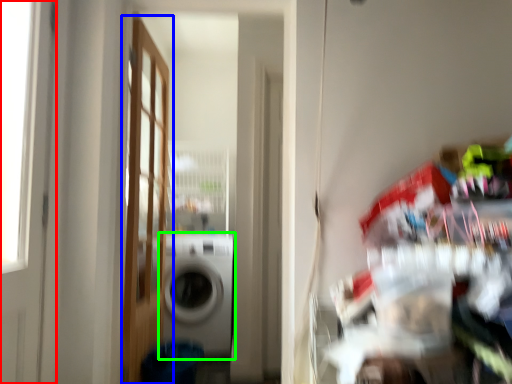
Question: Based on their relative distances, which object is nearer to door (highlighted by a red box)? Choose from door (highlighted by a blue box) and washing machine (highlighted by a green box).

Choices:
 (A) door
 (B) washing machine

Answer: (A)